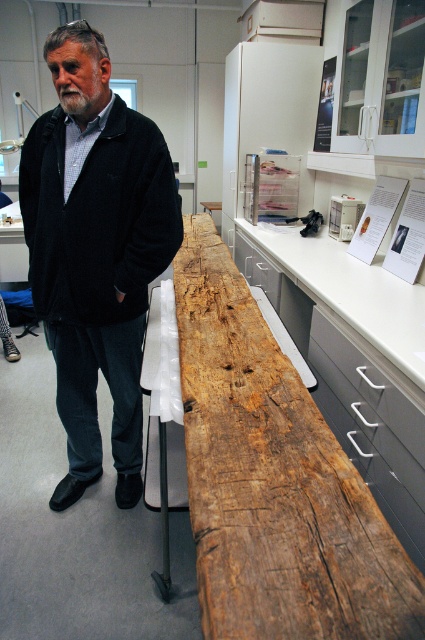
Is the position of weathered wood beam at center less distant than that of black woolen sweater at center?

Yes, weathered wood beam at center is in front of black woolen sweater at center.

Is point (217, 461) in front of point (53, 54)?

Yes, it is.

This screenshot has height=640, width=425. What do you see at coordinates (274, 481) in the screenshot? I see `weathered wood beam at center` at bounding box center [274, 481].

Find the location of a particular element. This screenshot has height=640, width=425. weathered wood beam at center is located at coordinates (274, 481).

Is the position of black woolen sweater at center more distant than that of white smooth countertop at center?

Yes, black woolen sweater at center is further from the viewer.

Who is positioned more to the left, black woolen sweater at center or white smooth countertop at center?

Positioned to the left is black woolen sweater at center.

Identify the location of black woolen sweater at center. This screenshot has height=640, width=425. (96, 252).

Can you confirm if weathered wood beam at center is taller than white smooth countertop at center?

No.

Who is more forward, [198,346] or [421,385]?

Point [421,385] is more forward.

Image resolution: width=425 pixels, height=640 pixels. Describe the element at coordinates (274, 481) in the screenshot. I see `weathered wood beam at center` at that location.

Identify the location of weathered wood beam at center. [274, 481].